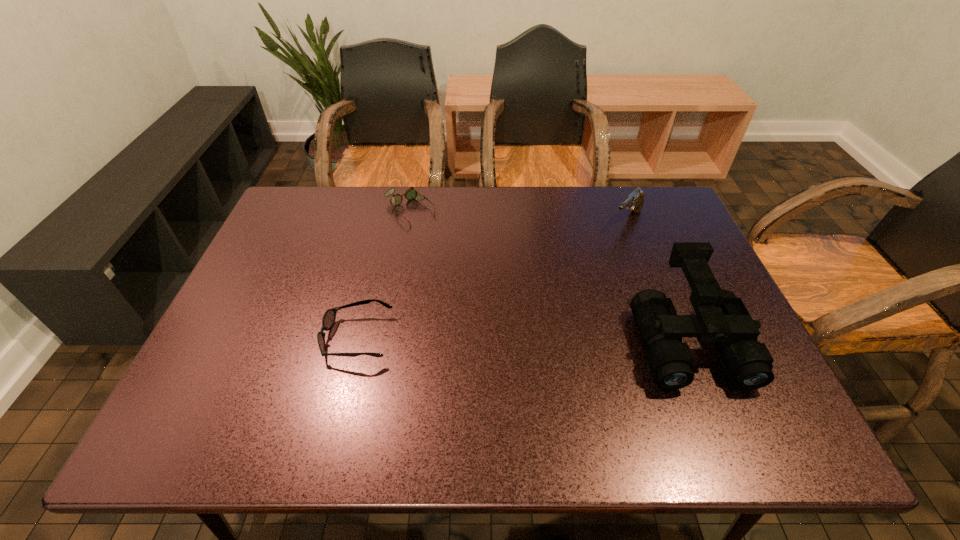
The height and width of the screenshot is (540, 960). What are the coordinates of `free spot located on the front-facing side of the spectacles` in the screenshot? It's located at (487, 288).

Where is `vacant space located 0.180m on the front-facing side of the spectacles`? This screenshot has width=960, height=540. vacant space located 0.180m on the front-facing side of the spectacles is located at coordinates (455, 256).

This screenshot has width=960, height=540. Identify the location of vacant region located 0.170m on the front-facing side of the spectacles. (453, 254).

The width and height of the screenshot is (960, 540). Find the location of `pistol at the far edge`. pistol at the far edge is located at coordinates (634, 202).

At what (x,y) coordinates should I click in order to perform the action: click on spectacles present at the far edge. Please return your answer as a coordinate pair (x, y). Looking at the image, I should click on (410, 194).

At what (x,y) coordinates should I click in order to perform the action: click on object positioned at the near edge. Please return your answer as a coordinate pair (x, y). The width and height of the screenshot is (960, 540). Looking at the image, I should click on (722, 318).

Locate an element on the screen. The height and width of the screenshot is (540, 960). binoculars located at the right edge is located at coordinates (722, 318).

What are the coordinates of `pistol at the right edge` in the screenshot? It's located at (634, 202).

Locate an element on the screen. The image size is (960, 540). object positioned at the far right corner is located at coordinates (634, 202).

At what (x,y) coordinates should I click in order to perform the action: click on object present at the near right corner. Please return your answer as a coordinate pair (x, y). This screenshot has height=540, width=960. Looking at the image, I should click on (722, 318).